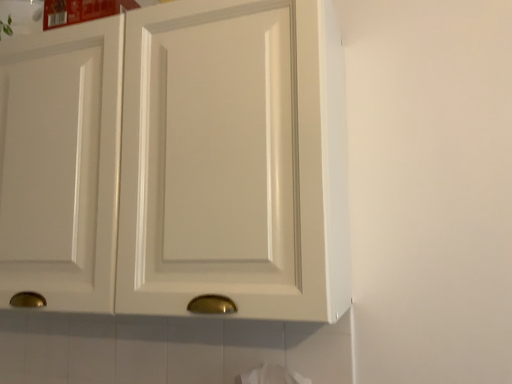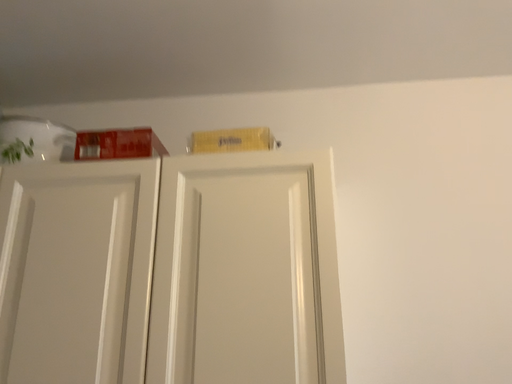
Question: How did the camera likely rotate when shooting the video?

Choices:
 (A) rotated right
 (B) rotated left

Answer: (A)